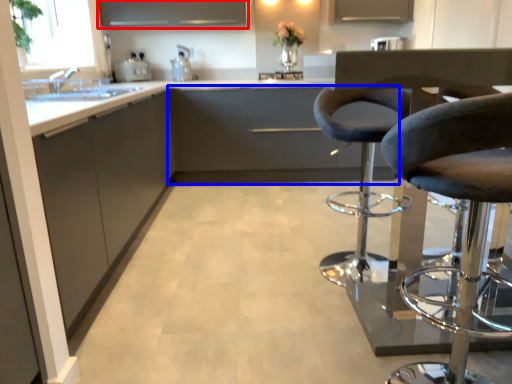
Question: Among these objects, which one is farthest to the camera, cabinetry (highlighted by a red box) or cabinetry (highlighted by a blue box)?

Choices:
 (A) cabinetry
 (B) cabinetry

Answer: (A)